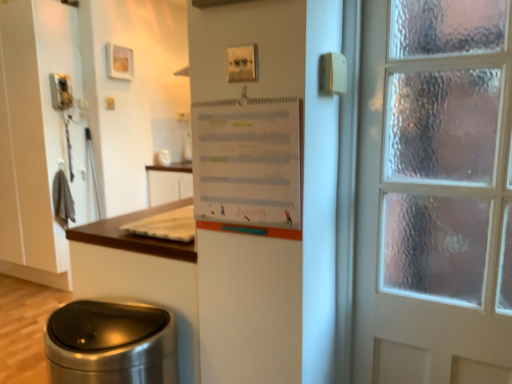
Question: Is white paper at upper center positioned beyond the bounds of polished stainless steel trash can at lower left?

Choices:
 (A) yes
 (B) no

Answer: (A)

Question: Is white paper at upper center oriented away from polished stainless steel trash can at lower left?

Choices:
 (A) yes
 (B) no

Answer: (B)

Question: Can you confirm if white paper at upper center is smaller than polished stainless steel trash can at lower left?

Choices:
 (A) yes
 (B) no

Answer: (A)

Question: Is white paper at upper center closer to the viewer compared to polished stainless steel trash can at lower left?

Choices:
 (A) yes
 (B) no

Answer: (A)

Question: From the image's perspective, is white paper at upper center over polished stainless steel trash can at lower left?

Choices:
 (A) yes
 (B) no

Answer: (A)

Question: From the image's perspective, is white paper at upper center below polished stainless steel trash can at lower left?

Choices:
 (A) no
 (B) yes

Answer: (A)

Question: Can you confirm if polished stainless steel trash can at lower left is wider than white paper at upper center?

Choices:
 (A) yes
 (B) no

Answer: (A)

Question: Does polished stainless steel trash can at lower left have a lesser width compared to white paper at upper center?

Choices:
 (A) yes
 (B) no

Answer: (B)

Question: From the image's perspective, would you say polished stainless steel trash can at lower left is shown under white paper at upper center?

Choices:
 (A) no
 (B) yes

Answer: (B)

Question: Considering the relative sizes of polished stainless steel trash can at lower left and white paper at upper center in the image provided, is polished stainless steel trash can at lower left shorter than white paper at upper center?

Choices:
 (A) no
 (B) yes

Answer: (A)

Question: Is polished stainless steel trash can at lower left located outside white paper at upper center?

Choices:
 (A) yes
 (B) no

Answer: (A)

Question: Is polished stainless steel trash can at lower left smaller than white paper at upper center?

Choices:
 (A) yes
 (B) no

Answer: (B)

Question: Considering the relative positions of polished stainless steel trash can at lower left and white paper at upper center in the image provided, is polished stainless steel trash can at lower left to the left or to the right of white paper at upper center?

Choices:
 (A) left
 (B) right

Answer: (A)